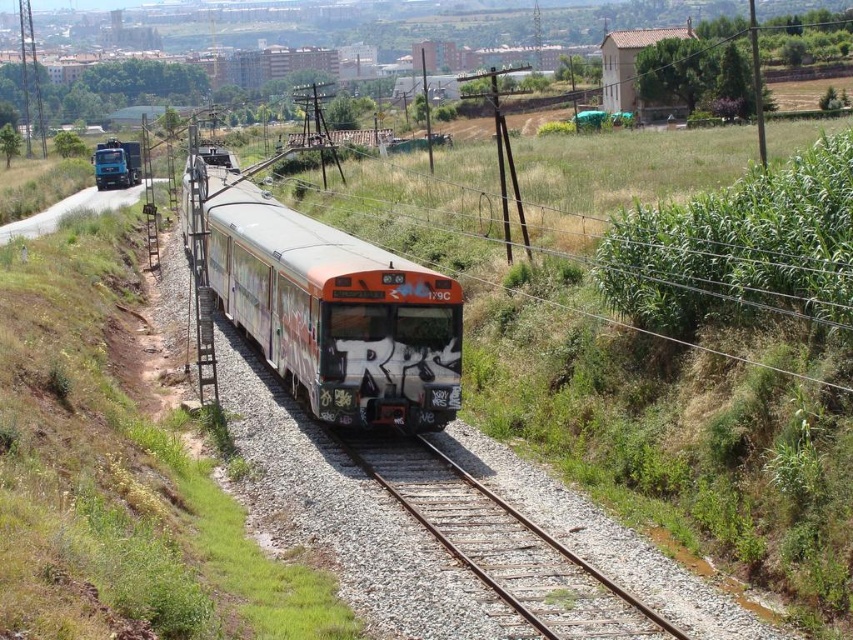
Question: Based on their relative distances, which object is nearer to the metal/gravel train track at center?

Choices:
 (A) brushed metal truck at left
 (B) white painted graffiti-covered train at center

Answer: (B)

Question: Does white painted graffiti-covered train at center have a smaller size compared to metal/gravel train track at center?

Choices:
 (A) no
 (B) yes

Answer: (A)

Question: Is the position of white painted graffiti-covered train at center more distant than that of brushed metal truck at left?

Choices:
 (A) no
 (B) yes

Answer: (A)

Question: Can you confirm if white painted graffiti-covered train at center is thinner than metal/gravel train track at center?

Choices:
 (A) yes
 (B) no

Answer: (B)

Question: Which object is the farthest from the brushed metal truck at left?

Choices:
 (A) metal/gravel train track at center
 (B) white painted graffiti-covered train at center

Answer: (A)

Question: Which of these objects is positioned closest to the metal/gravel train track at center?

Choices:
 (A) white painted graffiti-covered train at center
 (B) brushed metal truck at left

Answer: (A)